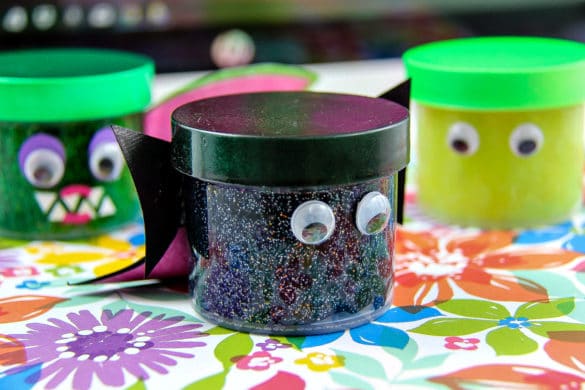
You are a GUI agent. You are given a task and a screenshot of the screen. Output one action in this format:
    pyautogui.click(x=<x>, y=<y>)
    Task: Click on the monitor bezel
    
    Given the screenshot: What is the action you would take?
    pyautogui.click(x=309, y=41)